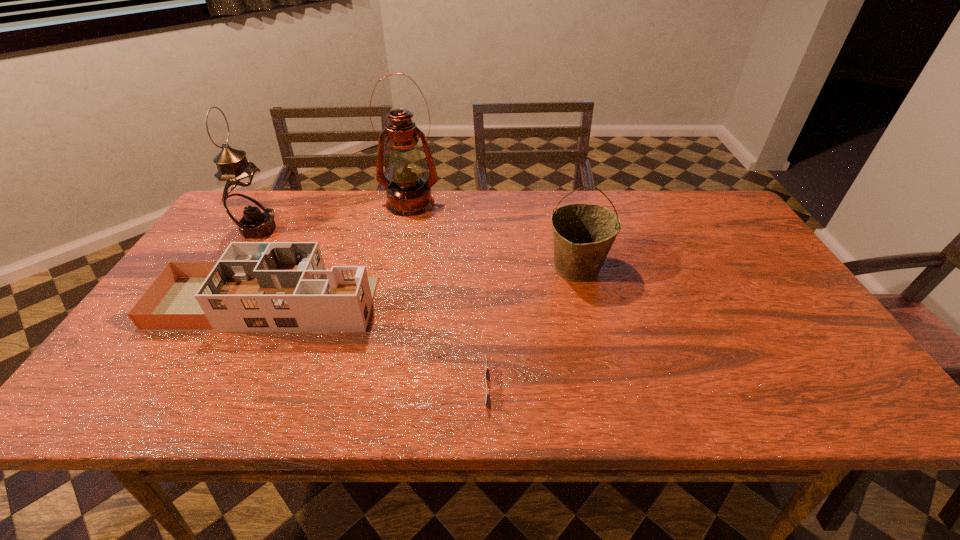
Find the location of a particular element. This screenshot has width=960, height=540. blank space at the far left corner of the desktop is located at coordinates (277, 202).

Find the location of a particular element. unoccupied position between the farther oil lamp and the shortest object is located at coordinates (x=436, y=295).

Image resolution: width=960 pixels, height=540 pixels. I want to click on blank region between the shortest object and the dollhouse, so click(x=364, y=345).

Where is `free space between the right oil lamp and the fourth nearest object`? free space between the right oil lamp and the fourth nearest object is located at coordinates (334, 217).

Where is `vacant area that lies between the fourth tallest object and the farther oil lamp`? This screenshot has width=960, height=540. vacant area that lies between the fourth tallest object and the farther oil lamp is located at coordinates click(x=339, y=253).

Find the location of a particular element. The width and height of the screenshot is (960, 540). free space between the rightmost object and the farther oil lamp is located at coordinates (493, 235).

This screenshot has height=540, width=960. Find the location of `free point between the rightmost object and the fourth tallest object`. free point between the rightmost object and the fourth tallest object is located at coordinates (422, 285).

Where is `free point between the fourth object from left to right and the farther oil lamp`? free point between the fourth object from left to right and the farther oil lamp is located at coordinates (436, 295).

Locate an element on the screen. the closest object to the farther oil lamp is located at coordinates (255, 286).

You are a GUI agent. You are given a task and a screenshot of the screen. Output one action in this format:
    pyautogui.click(x=<x>, y=<y>)
    Task: Click on the object that stands as the closest to the dollhouse
    The image size is (960, 540).
    Given the screenshot: What is the action you would take?
    point(244,197)